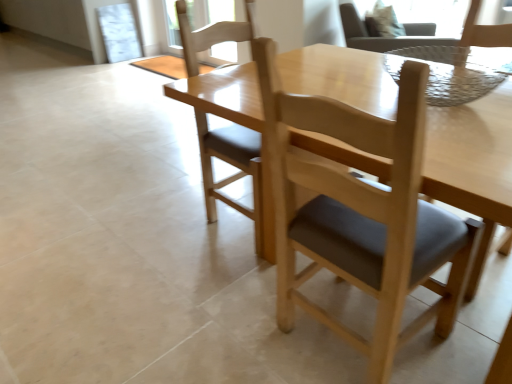
Question: In terms of height, does light brown wood chair at center, which ranks as the fourth chair in right-to-left order, look taller or shorter compared to light brown wood chair at upper right, marked as the 3th chair in a front-to-back arrangement?

Choices:
 (A) short
 (B) tall

Answer: (B)

Question: In the image, is light brown wood chair at center, which is counted as the 1th chair, starting from the left, positioned in front of or behind light brown wood chair at upper right, the second chair viewed from the top?

Choices:
 (A) front
 (B) behind

Answer: (A)

Question: Which object is positioned farthest from the light brown wood chair at upper right, which appears as the 4th chair when viewed from the left?

Choices:
 (A) light brown wood chair at upper right, the second chair viewed from the top
 (B) light brown wood chair at center, which is counted as the 3th chair, starting from the top
 (C) light brown wood chair at center, which is the third chair in right-to-left order

Answer: (A)

Question: Considering the real-world distances, which object is farthest from the light brown wood chair at center, placed as the 2th chair when sorted from left to right?

Choices:
 (A) light brown wood chair at center, which is the 3th chair from back to front
 (B) light brown wood chair at upper right, placed as the 4th chair when sorted from front to back
 (C) light brown wood chair at upper right, the 3th chair when ordered from bottom to top

Answer: (C)